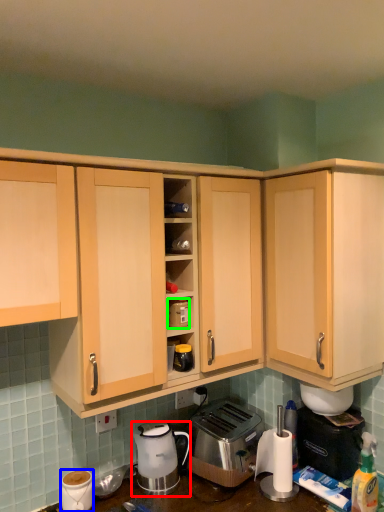
Question: Based on their relative distances, which object is farther from coffee maker (highlighted by a red box)? Choose from coffee cup (highlighted by a blue box) and appliance (highlighted by a green box).

Choices:
 (A) coffee cup
 (B) appliance

Answer: (B)